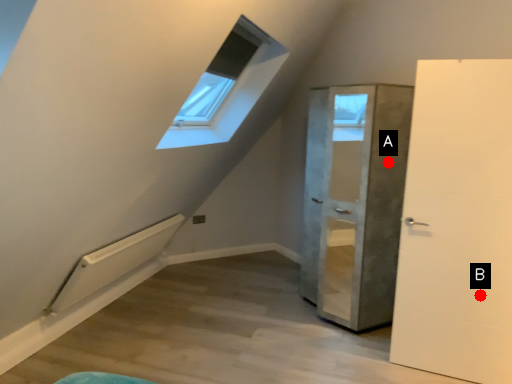
Question: Two points are circled on the image, labeled by A and B beside each circle. Which point is closer to the camera taking this photo?

Choices:
 (A) A is closer
 (B) B is closer

Answer: (B)